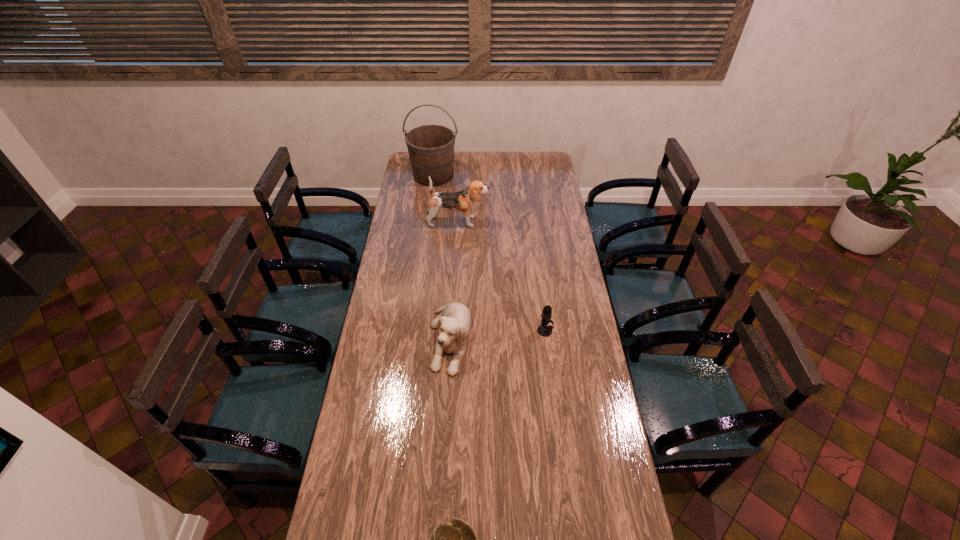
Where is `vacant space that is in between the tallest object and the rightmost object`? vacant space that is in between the tallest object and the rightmost object is located at coordinates (490, 253).

Locate an element on the screen. This screenshot has height=540, width=960. free area in between the rightmost object and the tallest object is located at coordinates (490, 253).

Identify the location of free space between the fourth tallest object and the third shortest object. (497, 335).

I want to click on free space between the shorter puppy and the microphone, so click(497, 335).

Choose which object is the third nearest neighbor to the bucket. Please provide its 2D coordinates. Your answer should be formatted as a tuple, i.e. [(x, y)], where the tuple contains the x and y coordinates of a point satisfying the conditions above.

[(544, 330)]

At what (x,y) coordinates should I click in order to perform the action: click on object that ranks as the fourth closest to the nearest object. Please return your answer as a coordinate pair (x, y). Image resolution: width=960 pixels, height=540 pixels. Looking at the image, I should click on (431, 147).

Locate an element on the screen. Image resolution: width=960 pixels, height=540 pixels. free space that satisfies the following two spatial constraints: 1. at the face of the fourth nearest object; 2. on the front-facing side of the shorter puppy is located at coordinates (451, 339).